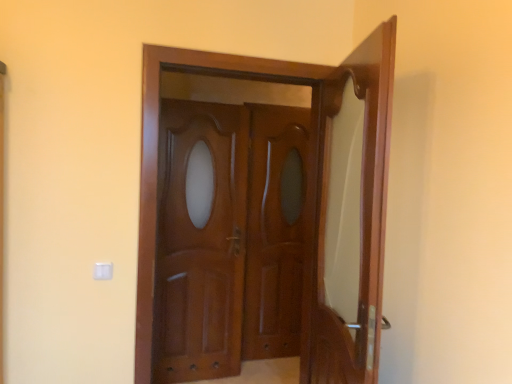
Question: From a real-world perspective, does mahogany wood door at right, positioned as the 2th door in left-to-right order, sit lower than glossy wood door at center, positioned as the first door in left-to-right order?

Choices:
 (A) no
 (B) yes

Answer: (B)

Question: Can you confirm if mahogany wood door at right, positioned as the 2th door in left-to-right order, is wider than glossy wood door at center, which is the 2th door in right-to-left order?

Choices:
 (A) yes
 (B) no

Answer: (A)

Question: Is mahogany wood door at right, which appears as the 1th door when viewed from the right, bigger than glossy wood door at center, positioned as the first door in left-to-right order?

Choices:
 (A) no
 (B) yes

Answer: (A)

Question: Can you confirm if mahogany wood door at right, positioned as the 2th door in left-to-right order, is smaller than glossy wood door at center, positioned as the first door in left-to-right order?

Choices:
 (A) yes
 (B) no

Answer: (A)

Question: Are mahogany wood door at right, which appears as the 1th door when viewed from the right, and glossy wood door at center, which is the 2th door in right-to-left order, located far from each other?

Choices:
 (A) yes
 (B) no

Answer: (B)

Question: Is glossy wood door at center situated inside mahogany wood door at center or outside?

Choices:
 (A) inside
 (B) outside

Answer: (B)

Question: Is point (257, 354) closer or farther from the camera than point (216, 130)?

Choices:
 (A) farther
 (B) closer

Answer: (A)

Question: Considering the positions of glossy wood door at center and mahogany wood door at center in the image, is glossy wood door at center taller or shorter than mahogany wood door at center?

Choices:
 (A) short
 (B) tall

Answer: (B)

Question: Looking at the image, does glossy wood door at center seem bigger or smaller compared to mahogany wood door at center?

Choices:
 (A) big
 (B) small

Answer: (B)

Question: Is glossy wood door at center, which is the 2th door in right-to-left order, situated inside glossy wood door at center or outside?

Choices:
 (A) outside
 (B) inside

Answer: (A)

Question: Is point (376, 144) closer or farther from the camera than point (288, 200)?

Choices:
 (A) closer
 (B) farther

Answer: (A)

Question: From a real-world perspective, relative to glossy wood door at center, is glossy wood door at center, which is the 2th door in right-to-left order, vertically above or below?

Choices:
 (A) above
 (B) below

Answer: (A)

Question: Visually, is glossy wood door at center, positioned as the first door in left-to-right order, positioned to the left or to the right of glossy wood door at center?

Choices:
 (A) right
 (B) left

Answer: (B)

Question: Is point (240, 220) positioned closer to the camera than point (333, 355)?

Choices:
 (A) farther
 (B) closer

Answer: (A)

Question: In terms of height, does mahogany wood door at center look taller or shorter compared to mahogany wood door at right, which appears as the 1th door when viewed from the right?

Choices:
 (A) tall
 (B) short

Answer: (A)